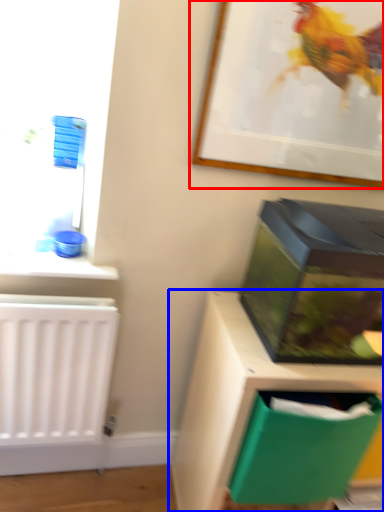
Question: Which point is further to the camera, picture frame (highlighted by a red box) or furniture (highlighted by a blue box)?

Choices:
 (A) picture frame
 (B) furniture

Answer: (B)